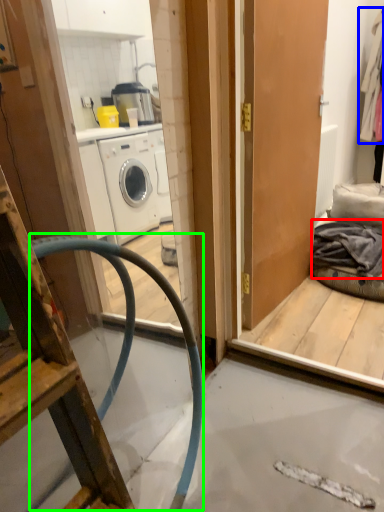
Question: Which is farther away from clothing (highlighted by a red box)? clothing (highlighted by a blue box) or garden hose (highlighted by a green box)?

Choices:
 (A) clothing
 (B) garden hose

Answer: (A)